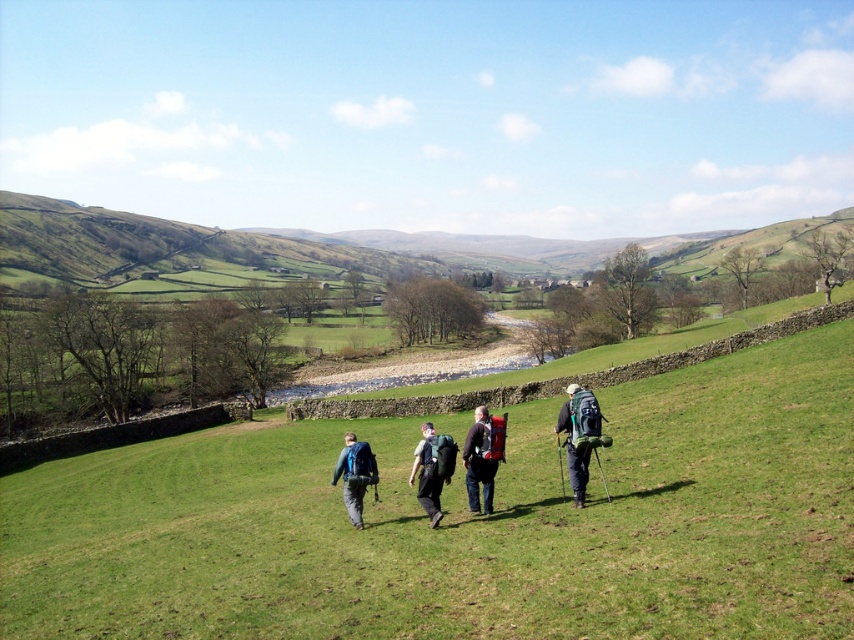
Consider the image. You are one of the hikers carrying both the matte green backpack at center and the green fabric backpack at center. Since both are at the same central position, which backpack takes up more horizontal space when viewed from your perspective?

The matte green backpack at center has a greater width than the green fabric backpack at center, so it occupies more horizontal space from your viewpoint.